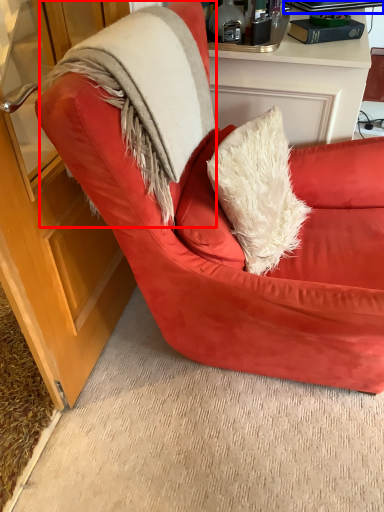
Question: Among these objects, which one is farthest to the camera, fur coat (highlighted by a red box) or laptop (highlighted by a blue box)?

Choices:
 (A) fur coat
 (B) laptop

Answer: (B)